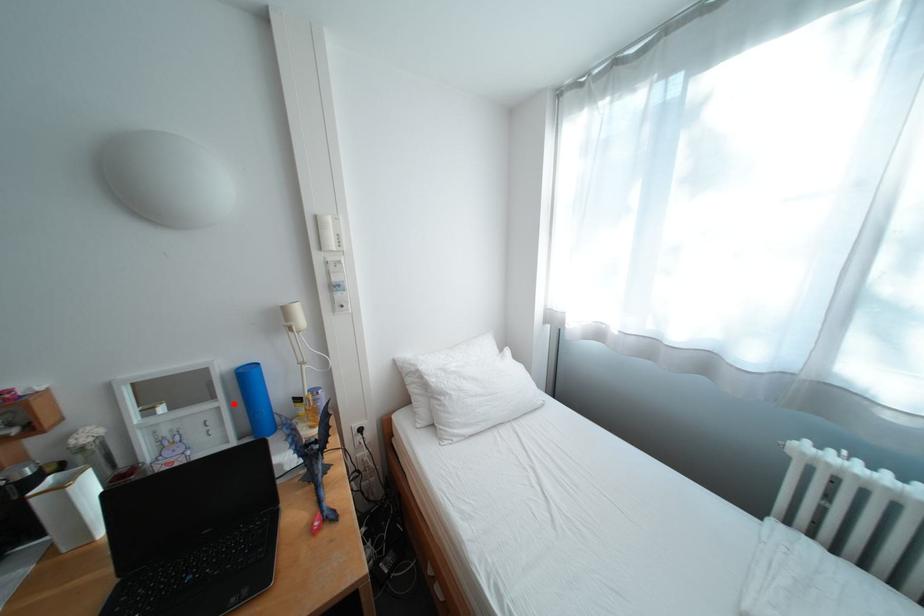
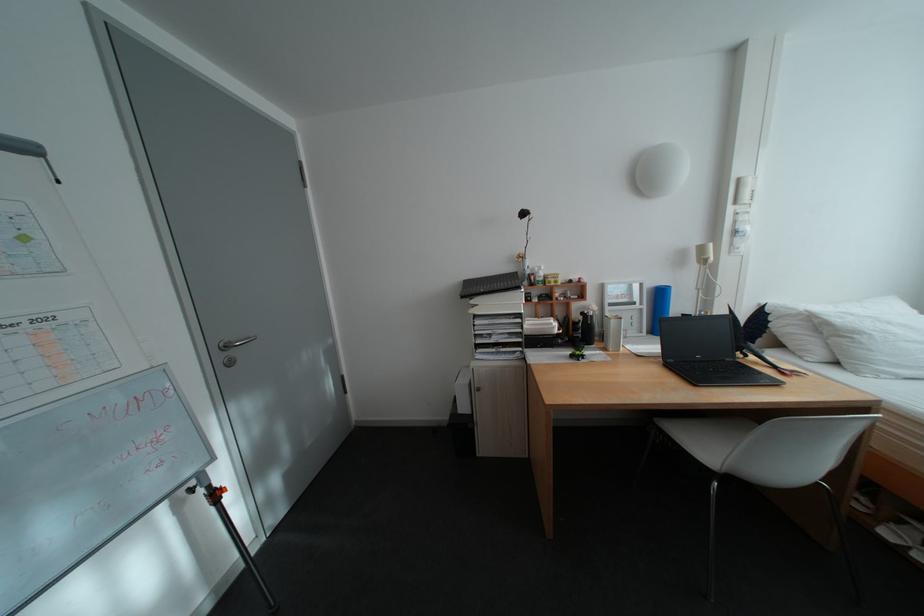
Where in the second image is the point corresponding to the highlighted location from the first image?

(657, 307)